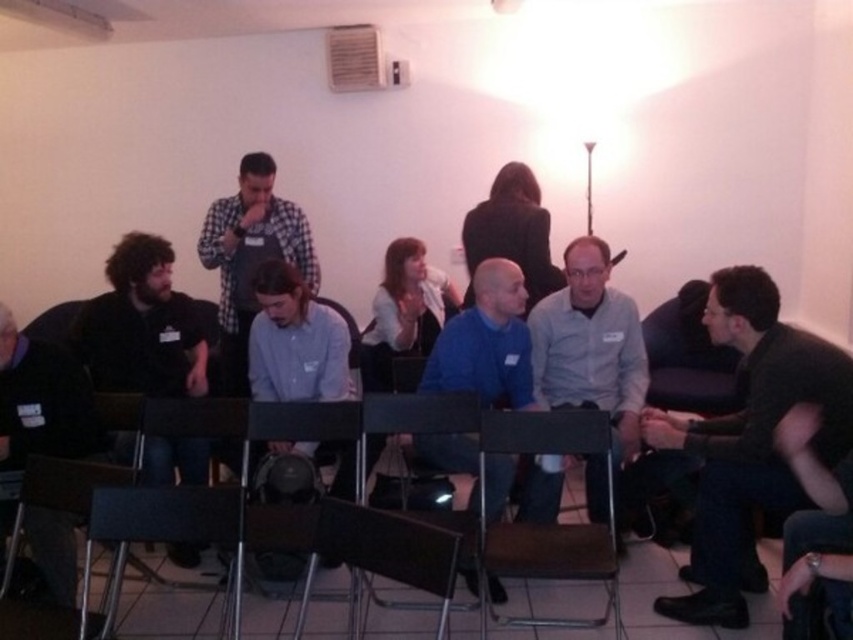
Is dark gray sweater at center below gray matte shirt at center?

Yes, dark gray sweater at center is below gray matte shirt at center.

Between dark gray sweater at center and gray matte shirt at center, which one appears on the left side from the viewer's perspective?

From the viewer's perspective, gray matte shirt at center appears more on the left side.

This screenshot has width=853, height=640. In order to click on dark gray sweater at center in this screenshot , I will do `click(749, 442)`.

Locate an element on the screen. Image resolution: width=853 pixels, height=640 pixels. dark gray sweater at center is located at coordinates (749, 442).

From the picture: Is black plastic chair at lower left below matte black chair at lower left?

Correct, black plastic chair at lower left is located below matte black chair at lower left.

Between black plastic chair at lower left and matte black chair at lower left, which one has more height?

matte black chair at lower left

The height and width of the screenshot is (640, 853). I want to click on black plastic chair at lower left, so click(x=161, y=522).

Which is behind, point (613, 611) or point (204, 502)?

The point (613, 611) is more distant.

Is brown fabric chair at center wider than black plastic chair at lower left?

Indeed, brown fabric chair at center has a greater width compared to black plastic chair at lower left.

Image resolution: width=853 pixels, height=640 pixels. Find the location of `brown fabric chair at center`. brown fabric chair at center is located at coordinates (547, 524).